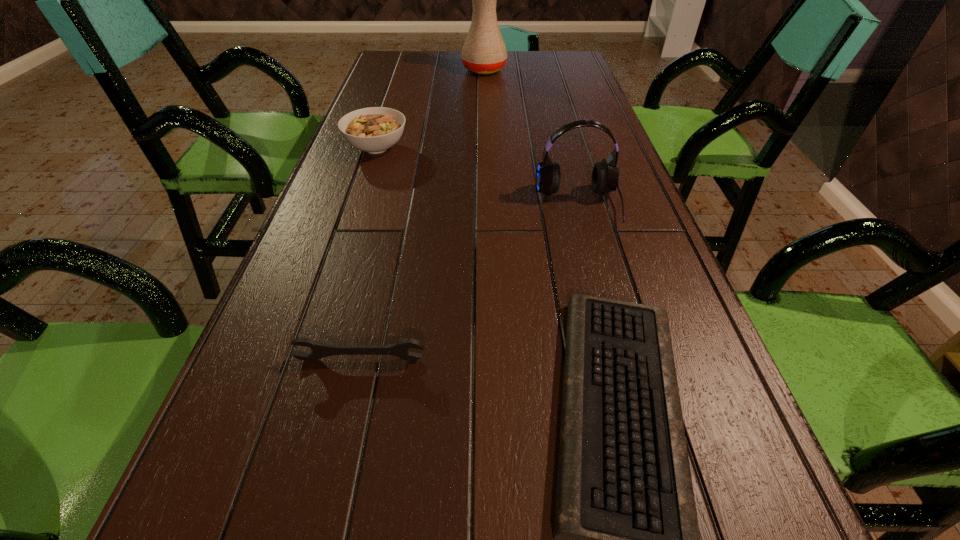
The height and width of the screenshot is (540, 960). In order to click on the farthest object in this screenshot , I will do (484, 52).

At what (x,y) coordinates should I click in order to perform the action: click on pottery. Please return your answer as a coordinate pair (x, y). This screenshot has width=960, height=540. Looking at the image, I should click on (484, 52).

Where is `headset`? This screenshot has width=960, height=540. headset is located at coordinates (605, 175).

What are the coordinates of `the second tallest object` in the screenshot? It's located at (605, 175).

I want to click on the third shortest object, so click(375, 129).

Find the location of `stew`. stew is located at coordinates (375, 129).

Locate an element on the screen. Image resolution: width=960 pixels, height=540 pixels. wrench is located at coordinates (319, 350).

The image size is (960, 540). I want to click on free point located on the front of the farthest object, so click(x=485, y=105).

The width and height of the screenshot is (960, 540). In order to click on free spot located 0.340m on the ear cushions of the headset in this screenshot , I will do `click(620, 364)`.

At what (x,y) coordinates should I click in order to perform the action: click on vacant region located on the right of the third tallest object. Please return your answer as a coordinate pair (x, y). The height and width of the screenshot is (540, 960). Looking at the image, I should click on (537, 148).